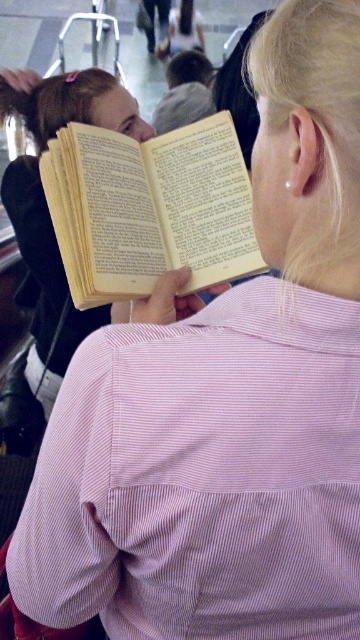
You are a photographer trying to capture a candid shot of the person reading the book. You notice a point at coordinates [203,476] on the image. Based on the scene description, where is this point located?

The point at [203,476] is located on the pink striped shirt at back.

You are a photographer trying to capture a candid shot of the person reading the book. The camera you are using has a focal length of 50mm. If the point where the person is reading is at coordinates point (75, 292), and the camera is positioned such that the distance between them is 29.13 inches, what is the approximate angle of view required to frame the person and the book clearly in the photo?

The angle of view required can be calculated using the formula for angle of view, which is 2 times the arctangent of the sensor size divided by twice the focal length. However, since the distance between the point and the camera is 29.13 inches, and the sensor size isntr provided, it might be better to use the distance and focal length to estimate the angle. With a 50mm lens, the angle of view typically ranges around 46 degrees diagonally. To frame the subject clearly at 29.13 inches, ensuring the person is